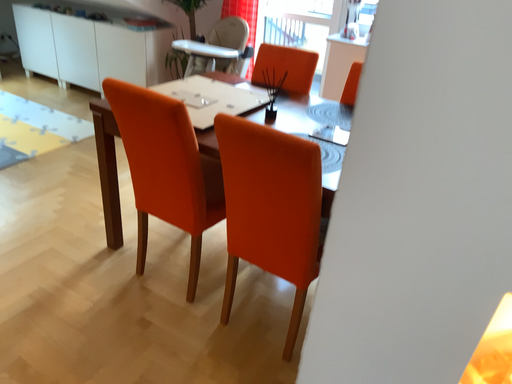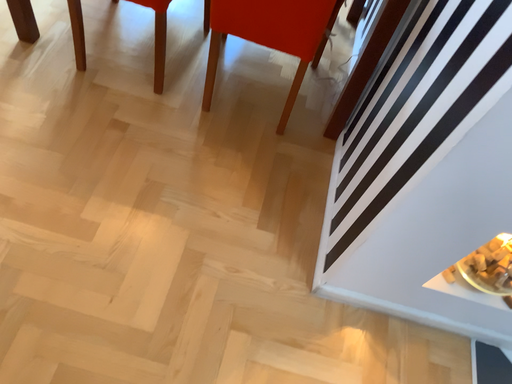
Question: Which way did the camera rotate in the video?

Choices:
 (A) rotated left
 (B) rotated right

Answer: (B)